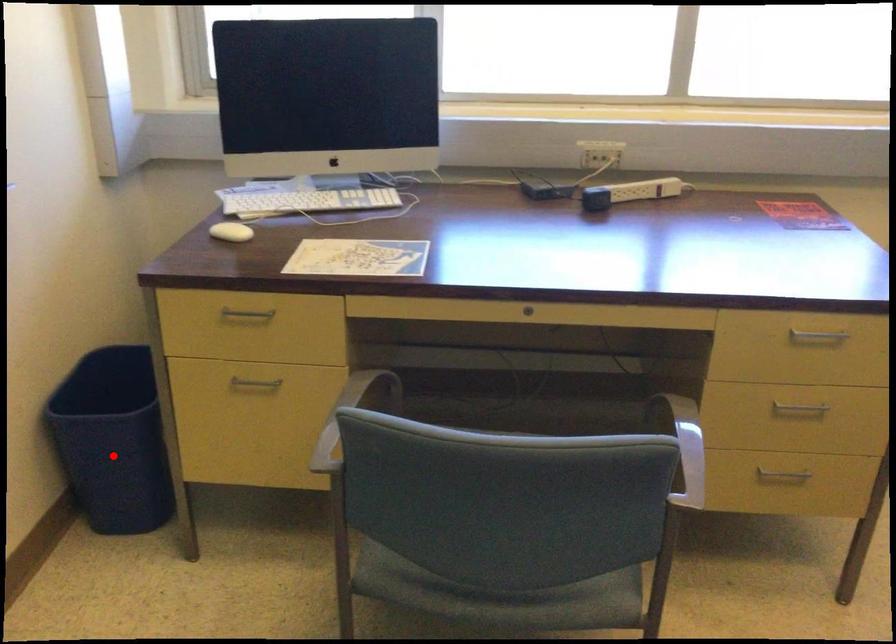
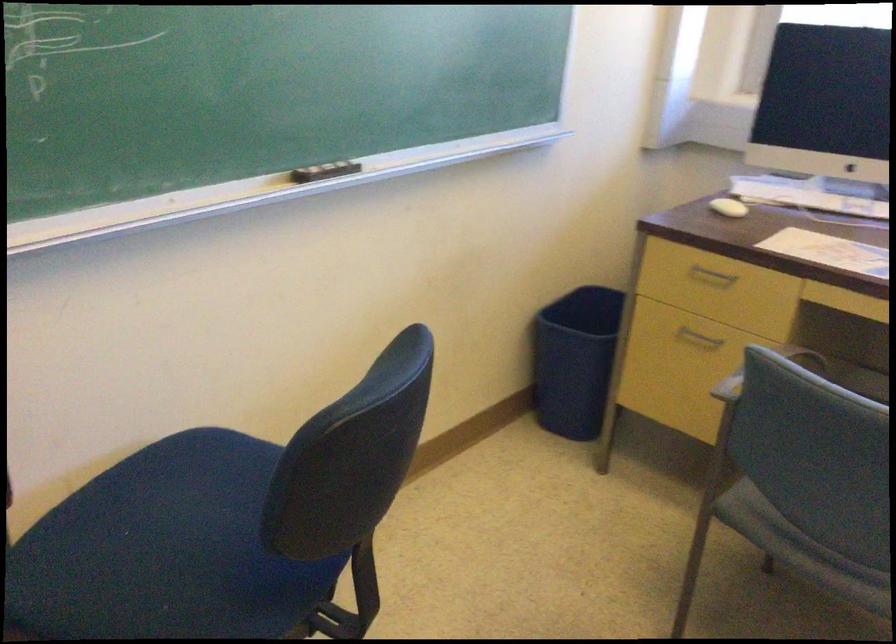
Question: I am providing you with two images of the same scene from different viewpoints. Image1 has a red point marked. In image2, the corresponding 3D location appears at what relative position? Reply with the corresponding letter.

Choices:
 (A) Closer
 (B) Farther

Answer: (B)